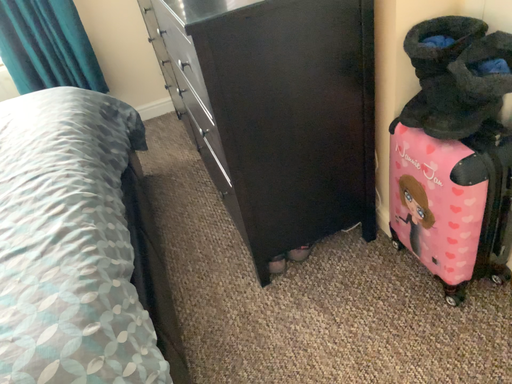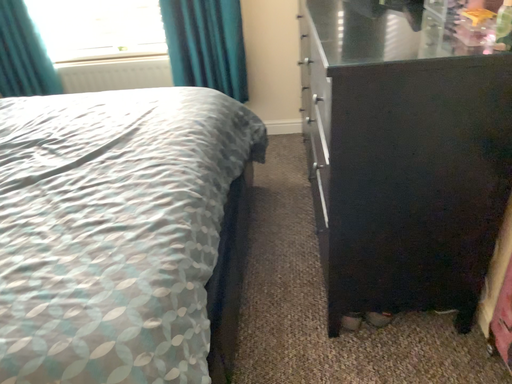
Question: Which way did the camera rotate in the video?

Choices:
 (A) rotated right
 (B) rotated left

Answer: (B)